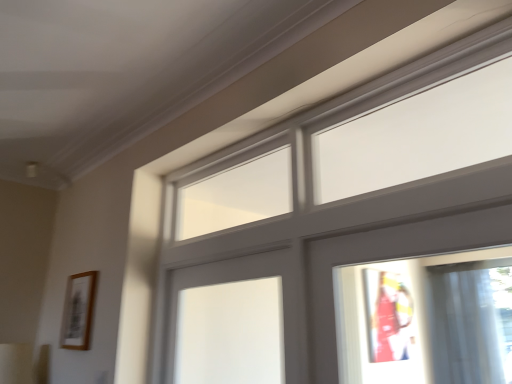
Question: Is matte gray window at upper center with wooden picture frame at left?

Choices:
 (A) no
 (B) yes

Answer: (A)

Question: Is matte gray window at upper center completely or partially outside of wooden picture frame at left?

Choices:
 (A) yes
 (B) no

Answer: (A)

Question: Is matte gray window at upper center far away from wooden picture frame at left?

Choices:
 (A) yes
 (B) no

Answer: (B)

Question: From a real-world perspective, is matte gray window at upper center physically above wooden picture frame at left?

Choices:
 (A) yes
 (B) no

Answer: (A)

Question: Does matte gray window at upper center have a greater height compared to wooden picture frame at left?

Choices:
 (A) no
 (B) yes

Answer: (B)

Question: From the image's perspective, would you say matte gray window at upper center is shown under wooden picture frame at left?

Choices:
 (A) no
 (B) yes

Answer: (A)

Question: Could you tell me if wooden picture frame at left is turned towards matte gray window at upper center?

Choices:
 (A) yes
 (B) no

Answer: (B)

Question: Would you say wooden picture frame at left is outside matte gray window at upper center?

Choices:
 (A) no
 (B) yes

Answer: (B)

Question: Is wooden picture frame at left behind matte gray window at upper center?

Choices:
 (A) no
 (B) yes

Answer: (B)

Question: From the image's perspective, does wooden picture frame at left appear lower than matte gray window at upper center?

Choices:
 (A) yes
 (B) no

Answer: (A)

Question: Is wooden picture frame at left not near matte gray window at upper center?

Choices:
 (A) yes
 (B) no

Answer: (B)

Question: Is wooden picture frame at left shorter than matte gray window at upper center?

Choices:
 (A) yes
 (B) no

Answer: (A)

Question: From the image's perspective, relative to wooden picture frame at left, is matte gray window at upper center above or below?

Choices:
 (A) below
 (B) above

Answer: (B)